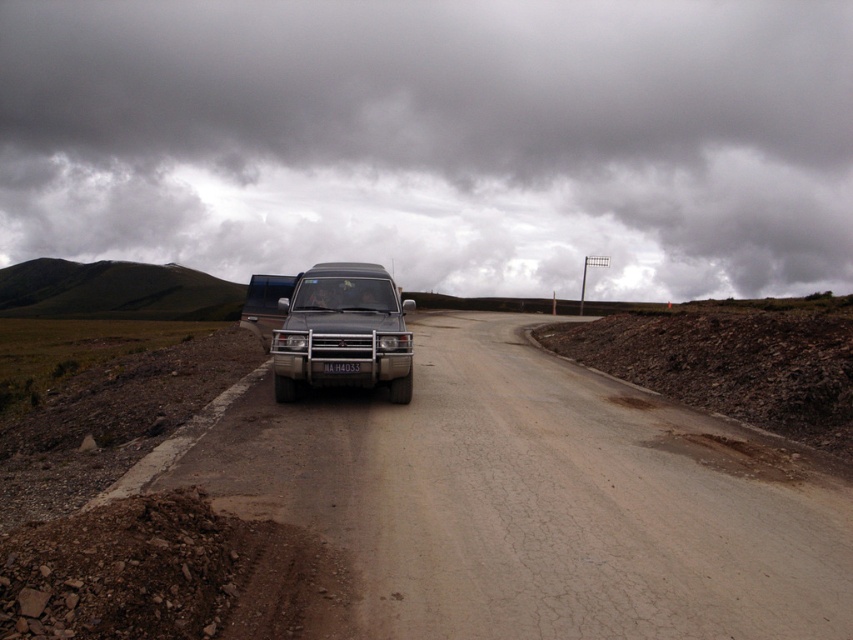
Question: Where is matte black jeep at center located in relation to silver metallic jeep at center in the image?

Choices:
 (A) below
 (B) above

Answer: (A)

Question: Which object is closer to the camera taking this photo?

Choices:
 (A) silver metallic jeep at center
 (B) matte black jeep at center

Answer: (B)

Question: Among these points, which one is farthest from the camera?

Choices:
 (A) (262, 300)
 (B) (335, 374)

Answer: (A)

Question: Can you confirm if matte black jeep at center is wider than silver metallic jeep at center?

Choices:
 (A) no
 (B) yes

Answer: (A)

Question: Is the position of matte black jeep at center more distant than that of silver metallic jeep at center?

Choices:
 (A) yes
 (B) no

Answer: (B)